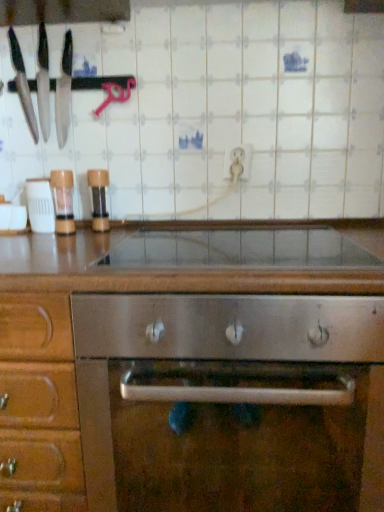
Question: Can you confirm if clear plastic shaker at left, placed as the second appliance when sorted from left to right, is wider than transparent glass countertop at center?

Choices:
 (A) no
 (B) yes

Answer: (A)

Question: Is clear plastic shaker at left, which ranks as the 2th appliance in right-to-left order, in contact with transparent glass countertop at center?

Choices:
 (A) yes
 (B) no

Answer: (B)

Question: Does clear plastic shaker at left, placed as the second appliance when sorted from left to right, turn towards transparent glass countertop at center?

Choices:
 (A) yes
 (B) no

Answer: (B)

Question: From the image's perspective, does clear plastic shaker at left, placed as the second appliance when sorted from left to right, appear lower than transparent glass countertop at center?

Choices:
 (A) yes
 (B) no

Answer: (B)

Question: Is clear plastic shaker at left, placed as the second appliance when sorted from left to right, not close to transparent glass countertop at center?

Choices:
 (A) yes
 (B) no

Answer: (B)

Question: Can you confirm if clear plastic shaker at left, placed as the second appliance when sorted from left to right, is taller than transparent glass countertop at center?

Choices:
 (A) yes
 (B) no

Answer: (A)

Question: Is brown wood pepper grinder at left, which ranks as the first appliance in right-to-left order, closer to camera compared to stainless steel knives at left, which ranks as the 2th kitchen appliance in left-to-right order?

Choices:
 (A) yes
 (B) no

Answer: (A)

Question: Is brown wood pepper grinder at left, acting as the 3th appliance starting from the left, at the right side of stainless steel knives at left, which is counted as the first kitchen appliance, starting from the right?

Choices:
 (A) yes
 (B) no

Answer: (A)

Question: Is brown wood pepper grinder at left, which ranks as the first appliance in right-to-left order, taller than stainless steel knives at left, which ranks as the 2th kitchen appliance in left-to-right order?

Choices:
 (A) yes
 (B) no

Answer: (B)

Question: Is brown wood pepper grinder at left, acting as the 3th appliance starting from the left, facing away from stainless steel knives at left, which ranks as the 2th kitchen appliance in left-to-right order?

Choices:
 (A) no
 (B) yes

Answer: (A)

Question: Is brown wood pepper grinder at left, which ranks as the first appliance in right-to-left order, oriented towards stainless steel knives at left, which ranks as the 2th kitchen appliance in left-to-right order?

Choices:
 (A) no
 (B) yes

Answer: (A)

Question: From the image's perspective, is brown wood pepper grinder at left, which ranks as the first appliance in right-to-left order, beneath stainless steel knives at left, which ranks as the 2th kitchen appliance in left-to-right order?

Choices:
 (A) yes
 (B) no

Answer: (A)

Question: From the image's perspective, does brown wood pepper grinder at left, which ranks as the first appliance in right-to-left order, appear higher than matte black knives at left, the 1th kitchen appliance viewed from the left?

Choices:
 (A) no
 (B) yes

Answer: (A)